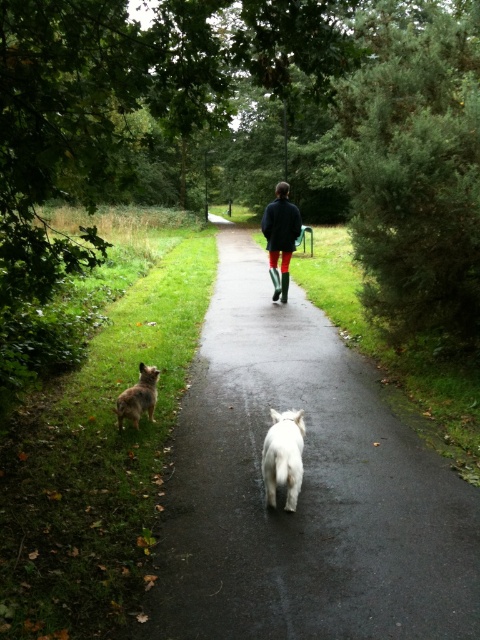
Question: Which of these objects is positioned closest to the dark blue jacket at center?

Choices:
 (A) brown fur dog at lower left
 (B) white fluffy dog at center

Answer: (A)

Question: Does dark asphalt path at center appear under brown fur dog at lower left?

Choices:
 (A) yes
 (B) no

Answer: (B)

Question: Which object appears closest to the camera in this image?

Choices:
 (A) dark blue jacket at center
 (B) brown fur dog at lower left
 (C) white fluffy dog at center

Answer: (C)

Question: Which of the following is the closest to the observer?

Choices:
 (A) (135, 396)
 (B) (283, 588)

Answer: (B)

Question: Where is dark asphalt path at center located in relation to dark blue jacket at center in the image?

Choices:
 (A) right
 (B) left

Answer: (B)

Question: Is dark asphalt path at center smaller than dark blue jacket at center?

Choices:
 (A) yes
 (B) no

Answer: (B)